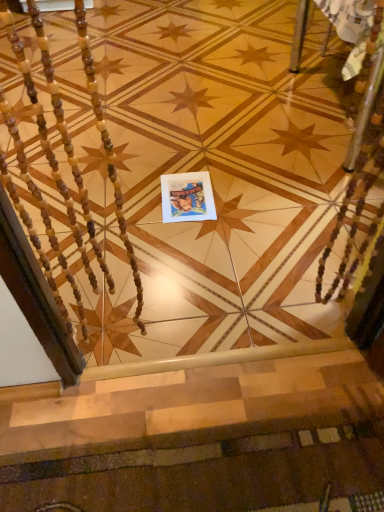
Question: Is carpeted stairs at lower center taller or shorter than matte paper postcard at center?

Choices:
 (A) tall
 (B) short

Answer: (B)

Question: In the image, is carpeted stairs at lower center positioned in front of or behind matte paper postcard at center?

Choices:
 (A) front
 (B) behind

Answer: (A)

Question: Is carpeted stairs at lower center to the left or to the right of matte paper postcard at center in the image?

Choices:
 (A) left
 (B) right

Answer: (B)

Question: From a real-world perspective, is matte paper postcard at center above or below carpeted stairs at lower center?

Choices:
 (A) below
 (B) above

Answer: (A)

Question: Is matte paper postcard at center in front of or behind carpeted stairs at lower center in the image?

Choices:
 (A) front
 (B) behind

Answer: (B)

Question: Is matte paper postcard at center inside the boundaries of carpeted stairs at lower center, or outside?

Choices:
 (A) inside
 (B) outside

Answer: (B)

Question: Does point (170, 197) appear closer or farther from the camera than point (218, 445)?

Choices:
 (A) farther
 (B) closer

Answer: (A)